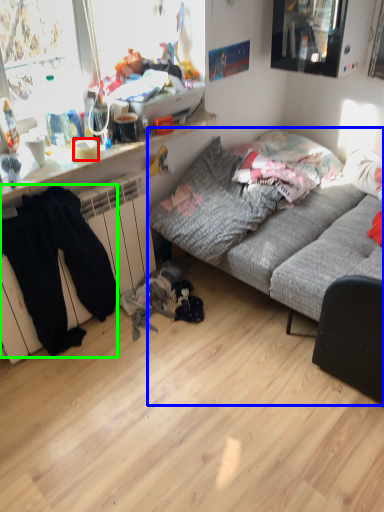
Question: Considering the real-world distances, which object is farthest from bowl (highlighted by a red box)? studio couch (highlighted by a blue box) or clothing (highlighted by a green box)?

Choices:
 (A) studio couch
 (B) clothing

Answer: (A)